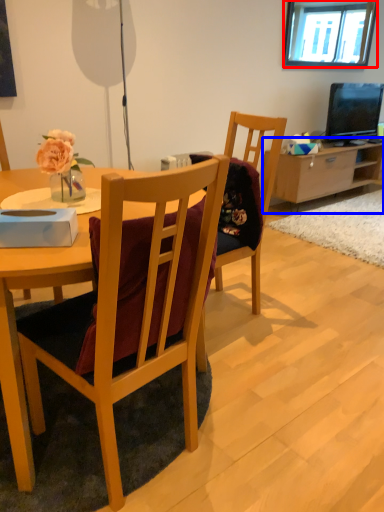
Question: Among these objects, which one is nearest to the camera, window (highlighted by a red box) or cabinetry (highlighted by a blue box)?

Choices:
 (A) window
 (B) cabinetry

Answer: (A)